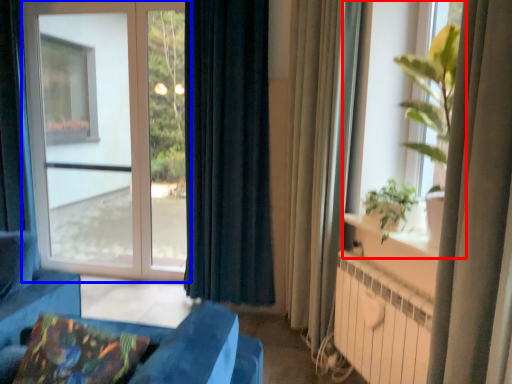
Question: Among these objects, which one is farthest to the camera, window (highlighted by a red box) or window (highlighted by a blue box)?

Choices:
 (A) window
 (B) window

Answer: (B)